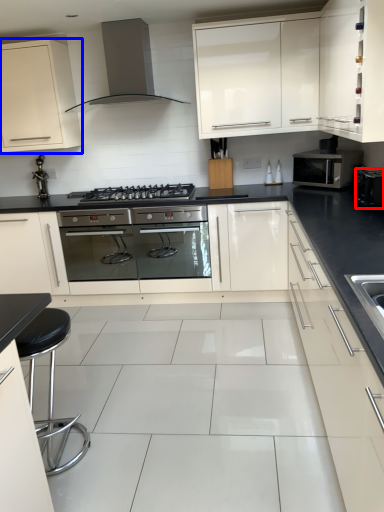
Question: Which of the following is the closest to the observer, appliance (highlighted by a red box) or cabinetry (highlighted by a blue box)?

Choices:
 (A) appliance
 (B) cabinetry

Answer: (A)